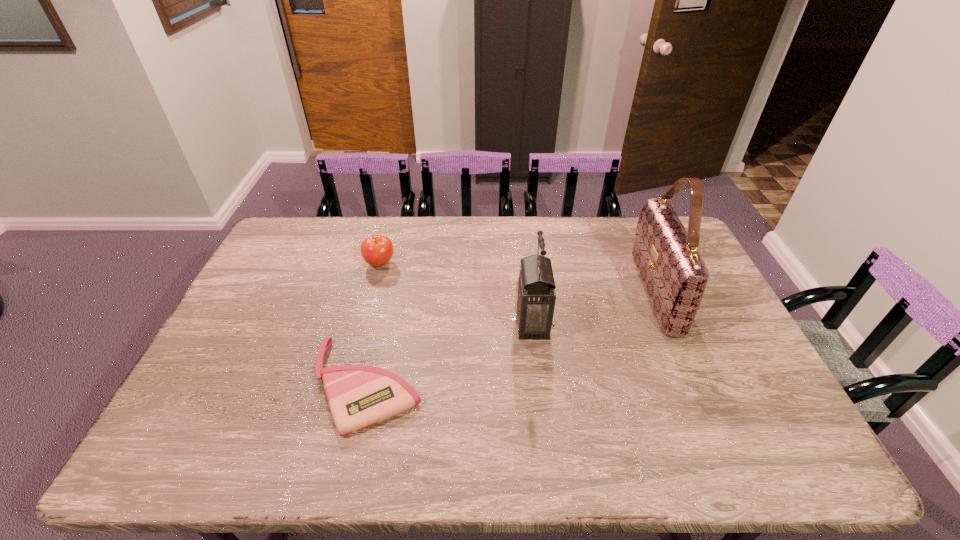
Locate an element on the screen. This screenshot has height=540, width=960. empty location between the wristlet and the handbag is located at coordinates (512, 339).

At what (x,y) coordinates should I click in order to perform the action: click on empty space that is in between the wristlet and the rightmost object. Please return your answer as a coordinate pair (x, y). This screenshot has height=540, width=960. Looking at the image, I should click on (512, 339).

At what (x,y) coordinates should I click in order to perform the action: click on vacant area between the third object from left to right and the third tallest object. Please return your answer as a coordinate pair (x, y). Looking at the image, I should click on (456, 294).

Identify the location of unoccupied area between the lantern and the rightmost object. This screenshot has height=540, width=960. (593, 308).

Identify the location of vacant space that is in between the wristlet and the second tallest object. (450, 355).

At what (x,y) coordinates should I click in order to perform the action: click on unoccupied area between the apple and the second tallest object. Please return your answer as a coordinate pair (x, y). Looking at the image, I should click on (456, 294).

This screenshot has width=960, height=540. What are the coordinates of `object that ranks as the closest to the wristlet` in the screenshot? It's located at (535, 298).

Identify which object is the third closest to the third tallest object. Please provide its 2D coordinates. Your answer should be formatted as a tuple, i.e. [(x, y)], where the tuple contains the x and y coordinates of a point satisfying the conditions above.

[(675, 276)]

Find the location of a particular element. Image resolution: width=960 pixels, height=540 pixels. free space that satisfies the following two spatial constraints: 1. on the front side of the third tallest object; 2. on the right side of the wristlet is located at coordinates (348, 385).